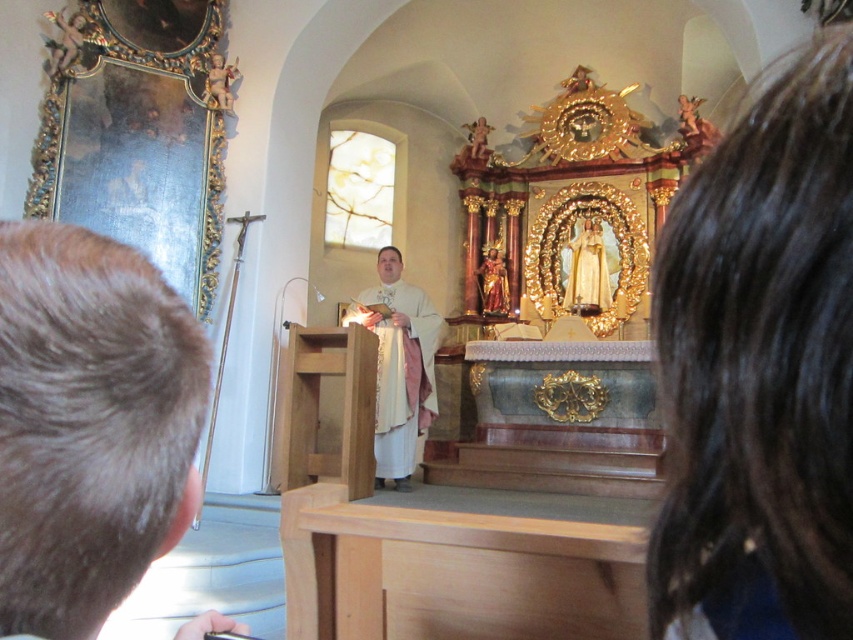
Question: Where is brown hair at left located in relation to white cloth at center in the image?

Choices:
 (A) above
 (B) below

Answer: (A)

Question: Which object is closer to the camera taking this photo?

Choices:
 (A) white cloth at center
 (B) brown hair at left

Answer: (B)

Question: Can you confirm if dark brown hair at upper right is wider than white cloth at center?

Choices:
 (A) no
 (B) yes

Answer: (A)

Question: Which point is farther to the camera?

Choices:
 (A) dark brown hair at upper right
 (B) brown hair at left
 (C) white cloth at center

Answer: (C)

Question: Can you confirm if brown hair at left is positioned above white cloth at center?

Choices:
 (A) yes
 (B) no

Answer: (A)

Question: Which point is closer to the camera taking this photo?

Choices:
 (A) (418, 305)
 (B) (181, 506)
 (C) (672, 451)

Answer: (C)